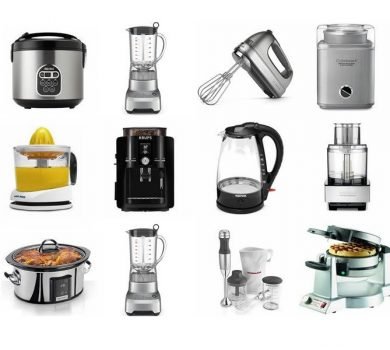
You are a GUI agent. You are given a task and a screenshot of the screen. Output one action in this format:
    pyautogui.click(x=<x>, y=<y>)
    Task: Click on the small container collection
    The image size is (390, 350).
    Given the screenshot: What is the action you would take?
    pyautogui.click(x=248, y=283)